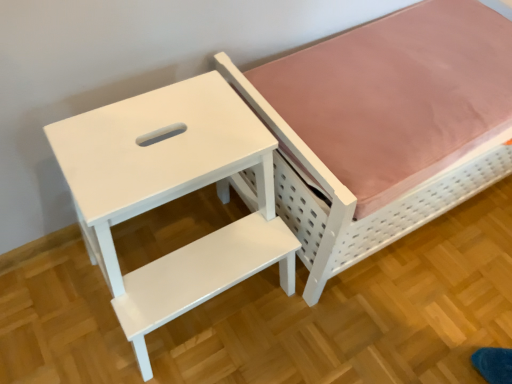
Question: Should I look upward or downward to see white matte bed at upper right?

Choices:
 (A) down
 (B) up

Answer: (B)

Question: Is white matte bed at upper right at the right side of white glossy step stool at upper left?

Choices:
 (A) no
 (B) yes

Answer: (B)

Question: Is white matte bed at upper right oriented away from white glossy step stool at upper left?

Choices:
 (A) no
 (B) yes

Answer: (A)

Question: Is the depth of white matte bed at upper right less than that of white glossy step stool at upper left?

Choices:
 (A) yes
 (B) no

Answer: (B)

Question: Is white matte bed at upper right directly adjacent to white glossy step stool at upper left?

Choices:
 (A) yes
 (B) no

Answer: (B)

Question: From the image's perspective, is white matte bed at upper right under white glossy step stool at upper left?

Choices:
 (A) no
 (B) yes

Answer: (A)

Question: Are white matte bed at upper right and white glossy step stool at upper left located far from each other?

Choices:
 (A) yes
 (B) no

Answer: (B)

Question: Does white glossy step stool at upper left have a larger size compared to white matte bed at upper right?

Choices:
 (A) yes
 (B) no

Answer: (B)

Question: Is there a large distance between white glossy step stool at upper left and white matte bed at upper right?

Choices:
 (A) yes
 (B) no

Answer: (B)

Question: From a real-world perspective, is white glossy step stool at upper left located beneath white matte bed at upper right?

Choices:
 (A) yes
 (B) no

Answer: (B)

Question: Considering the relative sizes of white glossy step stool at upper left and white matte bed at upper right in the image provided, is white glossy step stool at upper left smaller than white matte bed at upper right?

Choices:
 (A) no
 (B) yes

Answer: (B)

Question: Does white glossy step stool at upper left appear on the right side of white matte bed at upper right?

Choices:
 (A) no
 (B) yes

Answer: (A)

Question: From the image's perspective, does white glossy step stool at upper left appear lower than white matte bed at upper right?

Choices:
 (A) no
 (B) yes

Answer: (B)

Question: Considering the positions of white glossy step stool at upper left and white matte bed at upper right in the image, is white glossy step stool at upper left wider or thinner than white matte bed at upper right?

Choices:
 (A) thin
 (B) wide

Answer: (A)